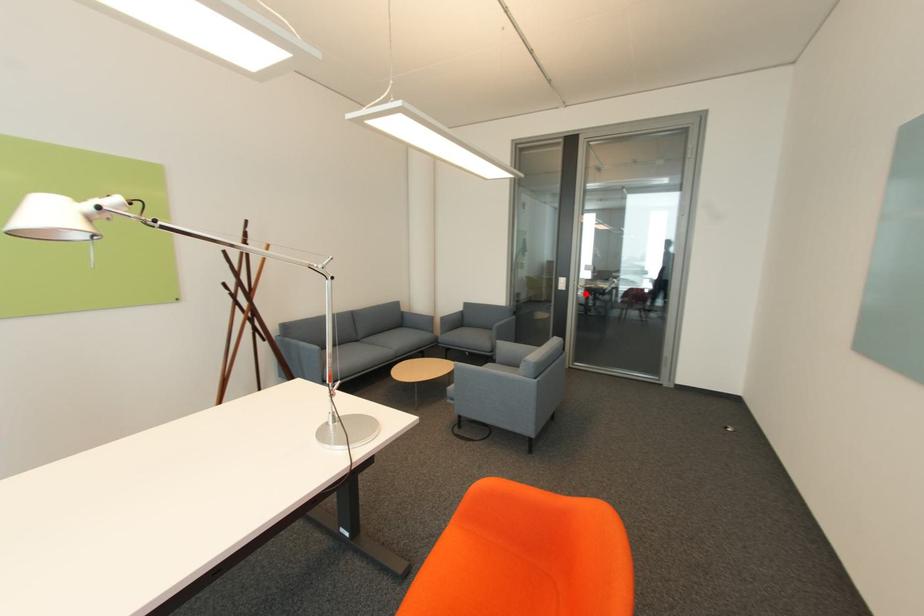
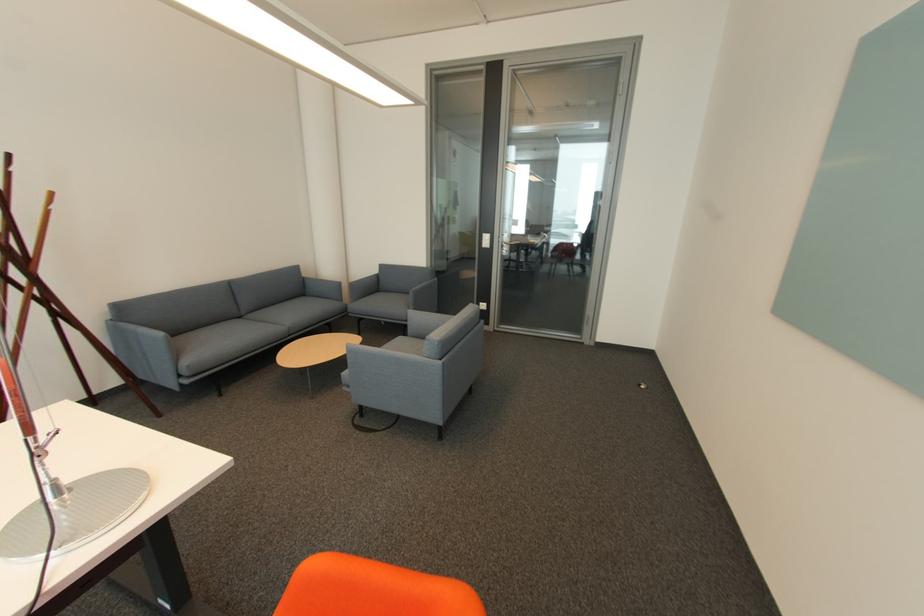
In the second image, find the point that corresponds to the highlighted location in the first image.

(508, 252)